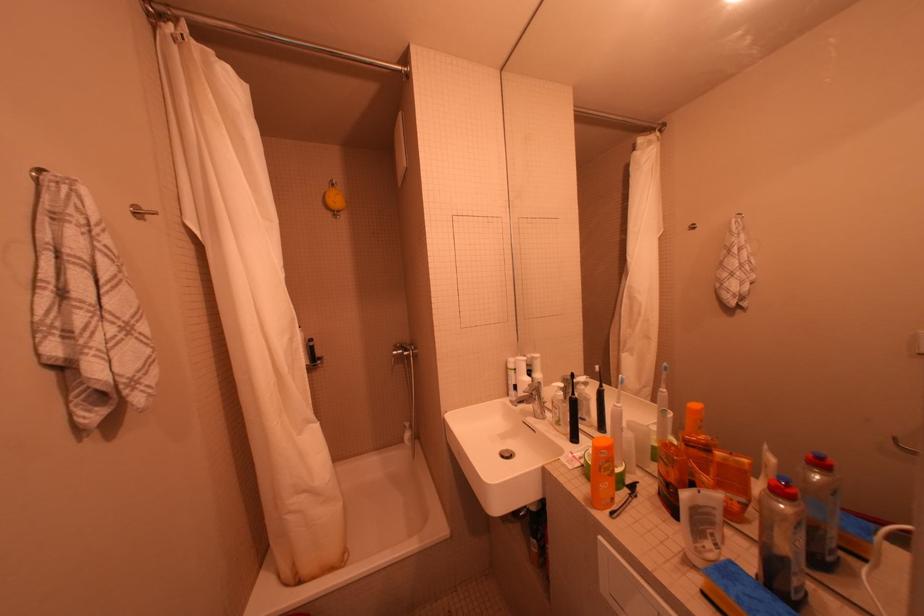
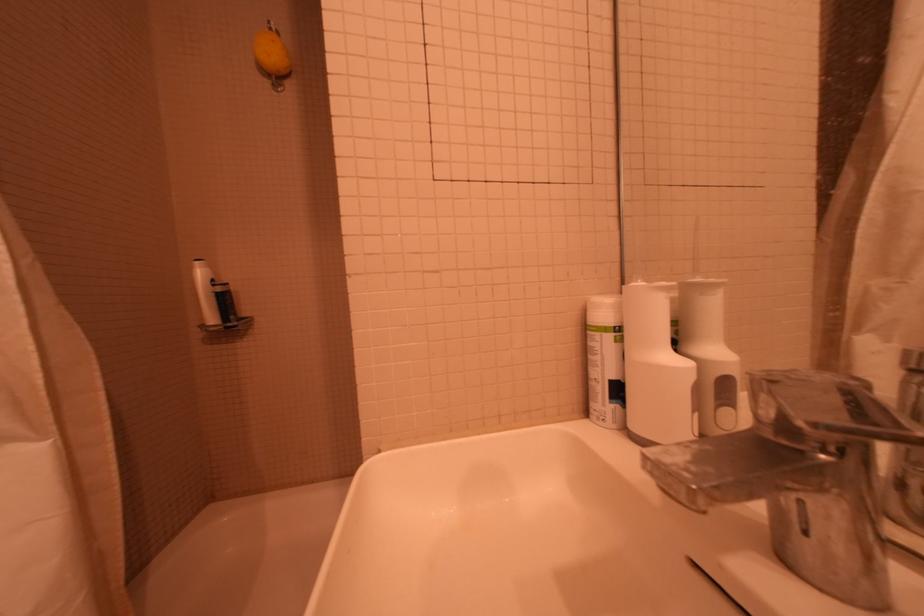
Where in the second image is the point corresponding to the point at 545,419 from the first image?

(831, 592)